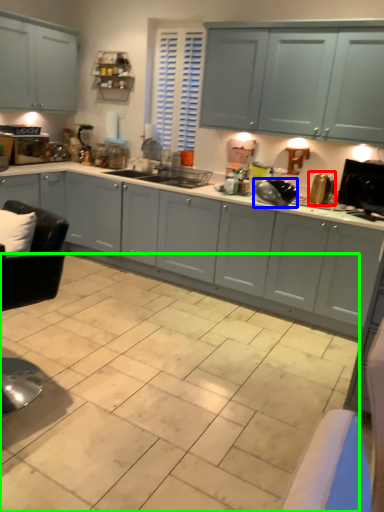
Question: Which is nearer to the appliance (highlighted by a red box)? appliance (highlighted by a blue box) or ceramic tile (highlighted by a green box).

Choices:
 (A) appliance
 (B) ceramic tile

Answer: (A)